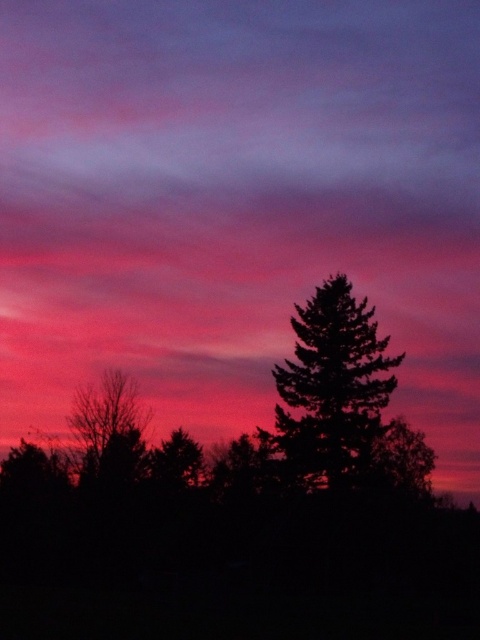
Is silhouette evergreen tree at center in front of bare branches at left?

Yes, silhouette evergreen tree at center is closer to the viewer.

Between point (364, 428) and point (80, 476), which one is positioned behind?

The point (80, 476) is more distant.

This screenshot has width=480, height=640. I want to click on silhouette evergreen tree at center, so click(x=332, y=390).